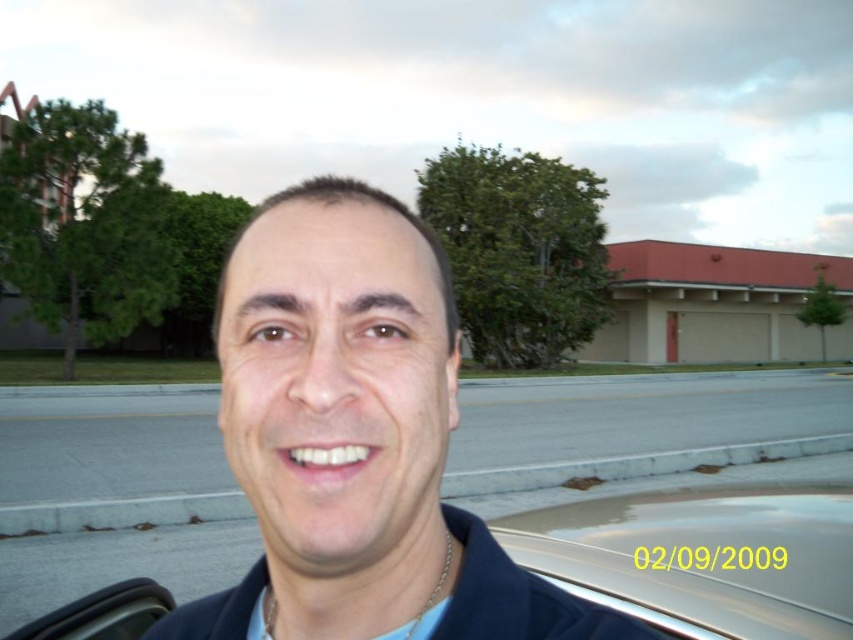
You are a photographer trying to capture the gold metallic car at lower center in your shot. However, the blue fabric shirt at center is blocking your view. Can you adjust your angle to see the car without moving the shirt?

The blue fabric shirt at center is positioned over the gold metallic car at lower center, so adjusting your angle might allow you to see the car below the shirt if possible.

You are a photographer trying to capture a shot of the blue fabric shirt at center and the gold metallic car at lower center. Based on their sizes in the image, which object would require you to move closer to fill the frame adequately?

The blue fabric shirt at center has a lesser width compared to the gold metallic car at lower center, so you would need to move closer to the blue fabric shirt at center to fill the frame adequately.

You are a photographer trying to capture the gold metallic car at lower center and the clear glass car window at lower right in a single shot. Based on their positions, which object should you focus on first if you want to ensure both are in focus?

The gold metallic car at lower center is located below the clear glass car window at lower right. To ensure both are in focus, you should focus on the gold metallic car at lower center first since it is closer to the camera, allowing the clear glass car window at lower right to fall within the depth of field.